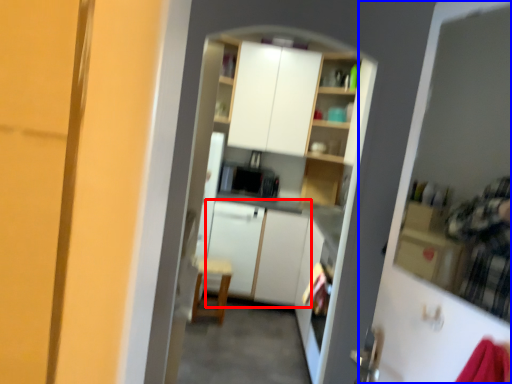
Question: Which of the following is the farthest to the observer, cabinetry (highlighted by a red box) or screen door (highlighted by a blue box)?

Choices:
 (A) cabinetry
 (B) screen door

Answer: (A)